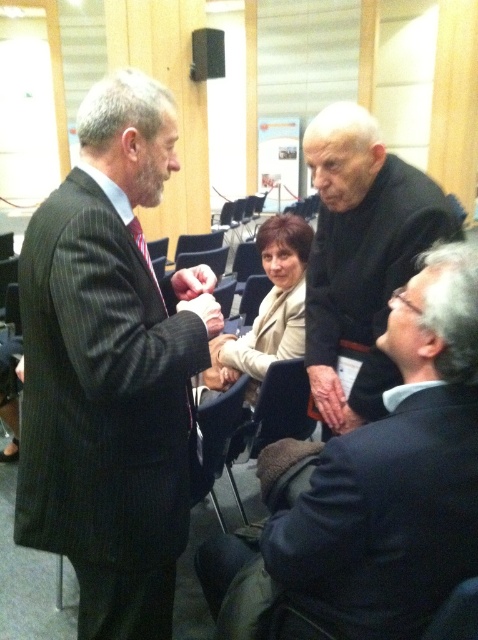
Which is above, dark pinstripe suit at left or dark suit at center?

dark pinstripe suit at left is above.

Is dark pinstripe suit at left below dark suit at center?

Actually, dark pinstripe suit at left is above dark suit at center.

Is point (53, 272) closer to viewer compared to point (395, 577)?

No, it is not.

The height and width of the screenshot is (640, 478). I want to click on dark pinstripe suit at left, so click(x=108, y=371).

Does dark suit at center have a smaller size compared to dry skin hand at lower center?

No.

Measure the distance between dark suit at center and camera.

dark suit at center is 37.45 inches from camera.

Is point (443, 564) positioned in front of point (336, 387)?

Yes, point (443, 564) is in front of point (336, 387).

This screenshot has width=478, height=640. I want to click on dark suit at center, so click(380, 480).

Who is positioned more to the left, dark suit at center or black matte suit at upper right?

dark suit at center is more to the left.

Can you confirm if dark suit at center is positioned to the left of black matte suit at upper right?

Yes, dark suit at center is to the left of black matte suit at upper right.

Locate an element on the screen. The image size is (478, 640). dark suit at center is located at coordinates (380, 480).